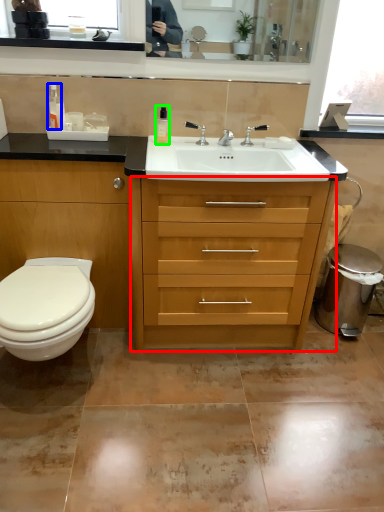
Question: Which object is positioned farthest from chest of drawers (highlighted by a red box)? Select from toiletry (highlighted by a blue box) and toiletry (highlighted by a green box).

Choices:
 (A) toiletry
 (B) toiletry

Answer: (A)